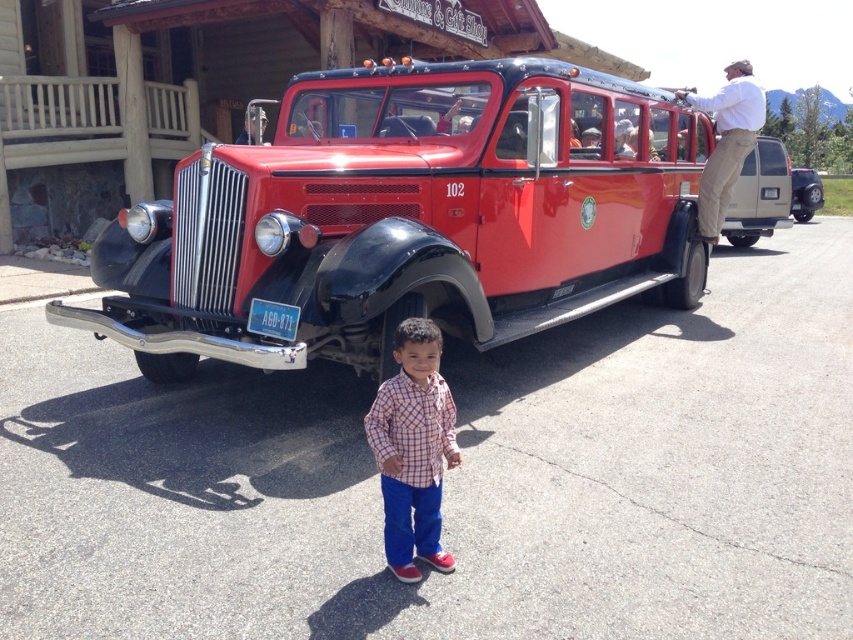
Which is in front, point (183, 353) or point (804, 189)?

Point (183, 353) is in front.

Who is positioned more to the right, shiny red bus at center or metallic silver suv at right?

Positioned to the right is metallic silver suv at right.

Is point (560, 310) more distant than point (817, 198)?

No, it is in front of (817, 198).

Locate an element on the screen. Image resolution: width=853 pixels, height=640 pixels. shiny red bus at center is located at coordinates click(408, 218).

Between plaid shirt at center and khaki pants at upper right, which one is positioned higher?

khaki pants at upper right is higher up.

What do you see at coordinates (413, 449) in the screenshot? The image size is (853, 640). I see `plaid shirt at center` at bounding box center [413, 449].

Is point (439, 424) more distant than point (705, 224)?

No, (439, 424) is in front of (705, 224).

Where is `plaid shirt at center`? This screenshot has width=853, height=640. plaid shirt at center is located at coordinates (413, 449).

Can you confirm if plaid shirt at center is shorter than metallic silver suv at right?

Correct, plaid shirt at center is not as tall as metallic silver suv at right.

Measure the distance between plaid shirt at center and camera.

They are 9.27 feet apart.

Locate an element on the screen. This screenshot has width=853, height=640. plaid shirt at center is located at coordinates (413, 449).